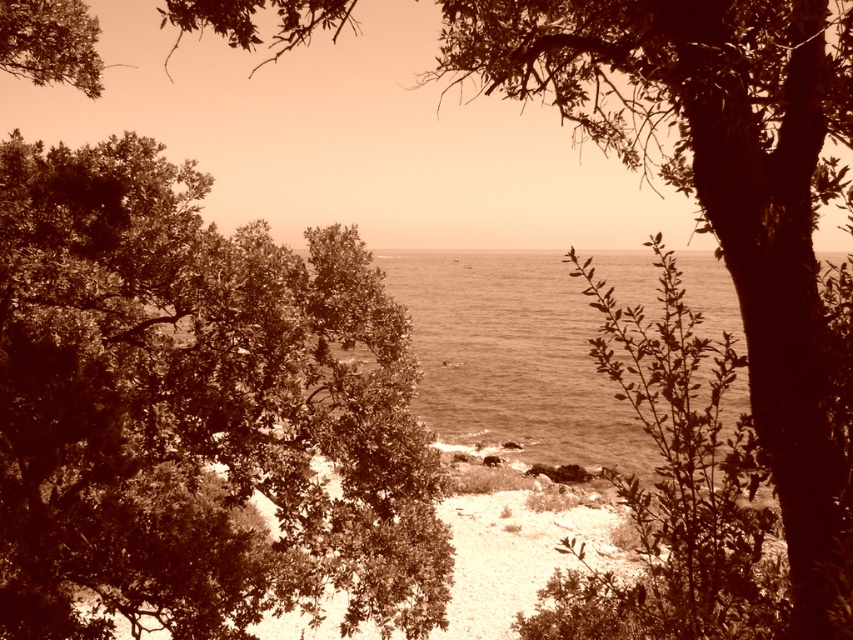
Is green leafy tree at center positioned at the back of sepia water at center?

No, green leafy tree at center is in front of sepia water at center.

At what (x,y) coordinates should I click in order to perform the action: click on green leafy tree at center. Please return your answer as a coordinate pair (x, y). Image resolution: width=853 pixels, height=640 pixels. Looking at the image, I should click on (196, 410).